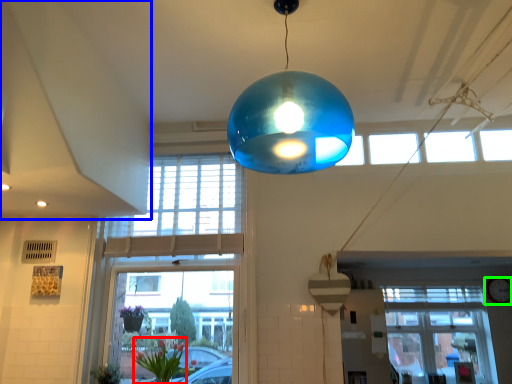
Question: Based on their relative distances, which object is farther from floral arrangement (highlighted by a red box)? Choose from exhaust hood (highlighted by a blue box) and clock (highlighted by a green box).

Choices:
 (A) exhaust hood
 (B) clock

Answer: (B)